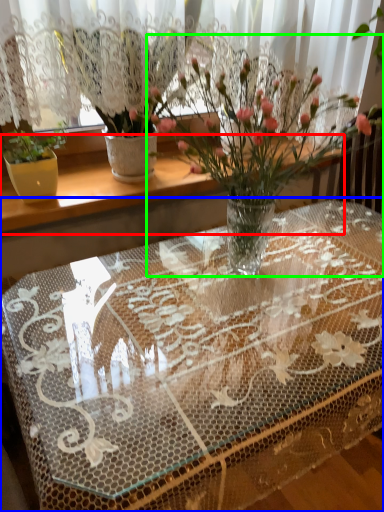
Question: Which object is the closest to the window sill (highlighted by a red box)? Choose among these: table (highlighted by a blue box) or houseplant (highlighted by a green box).

Choices:
 (A) table
 (B) houseplant

Answer: (B)